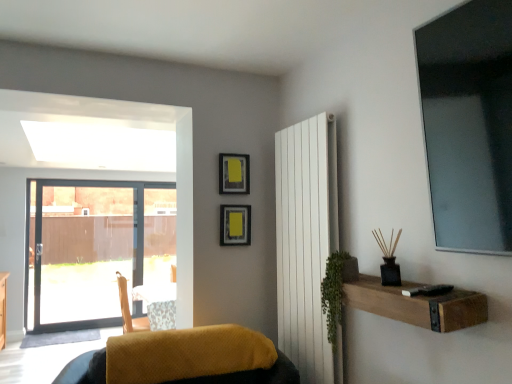
What are the coordinates of `velvet yellow cushion at lower center` in the screenshot? It's located at (184, 359).

The height and width of the screenshot is (384, 512). Describe the element at coordinates (306, 244) in the screenshot. I see `white smooth radiator at center-right` at that location.

Find the location of a particular element. This screenshot has width=512, height=384. brown wooden shelf at lower right is located at coordinates (417, 304).

The image size is (512, 384). In order to click on green leafy plant at right in this screenshot , I will do `click(333, 293)`.

From the image's perspective, is velvet yellow cushion at lower center located above or below white smooth radiator at center-right?

velvet yellow cushion at lower center is situated lower than white smooth radiator at center-right in the image.

Considering the points (85, 374) and (335, 189), which point is behind, point (85, 374) or point (335, 189)?

The point (335, 189) is more distant.

Measure the distance between velvet yellow cushion at lower center and white smooth radiator at center-right.

velvet yellow cushion at lower center and white smooth radiator at center-right are 19.61 inches apart from each other.

Considering the relative positions of velvet yellow cushion at lower center and white smooth radiator at center-right in the image provided, is velvet yellow cushion at lower center to the right of white smooth radiator at center-right from the viewer's perspective?

No, velvet yellow cushion at lower center is not to the right of white smooth radiator at center-right.

Does point (325, 135) come closer to viewer compared to point (461, 298)?

No, (325, 135) is behind (461, 298).

Consider the image. Looking at the image, does white smooth radiator at center-right seem bigger or smaller compared to brown wooden shelf at lower right?

Considering their sizes, white smooth radiator at center-right takes up more space than brown wooden shelf at lower right.

Is white smooth radiator at center-right positioned far away from brown wooden shelf at lower right?

white smooth radiator at center-right is actually quite close to brown wooden shelf at lower right.

Is white smooth radiator at center-right positioned in front of velvet yellow cushion at lower center?

No, it is behind velvet yellow cushion at lower center.

Could you tell me if white smooth radiator at center-right is facing velvet yellow cushion at lower center?

Yes, white smooth radiator at center-right is turned towards velvet yellow cushion at lower center.

From the image's perspective, is white smooth radiator at center-right located above or below velvet yellow cushion at lower center?

From the image's perspective, white smooth radiator at center-right appears above velvet yellow cushion at lower center.

Can you confirm if white smooth radiator at center-right is thinner than velvet yellow cushion at lower center?

Correct, the width of white smooth radiator at center-right is less than that of velvet yellow cushion at lower center.

Considering the positions of objects green leafy plant at right and brown wooden shelf at lower right in the image provided, who is in front, green leafy plant at right or brown wooden shelf at lower right?

brown wooden shelf at lower right is closer to the camera.

Considering the positions of objects green leafy plant at right and brown wooden shelf at lower right in the image provided, who is more to the right, green leafy plant at right or brown wooden shelf at lower right?

From the viewer's perspective, brown wooden shelf at lower right appears more on the right side.

Is green leafy plant at right surrounding brown wooden shelf at lower right?

No, brown wooden shelf at lower right is located outside of green leafy plant at right.

Is point (335, 299) closer or farther from the camera than point (397, 287)?

Point (335, 299) is positioned farther from the camera compared to point (397, 287).

Does green leafy plant at right appear on the left side of velvet yellow cushion at lower center?

In fact, green leafy plant at right is to the right of velvet yellow cushion at lower center.

Looking at this image, from the image's perspective, is green leafy plant at right located above or below velvet yellow cushion at lower center?

From the image's perspective, green leafy plant at right appears above velvet yellow cushion at lower center.

Would you say green leafy plant at right is inside or outside velvet yellow cushion at lower center?

green leafy plant at right is outside velvet yellow cushion at lower center.

In the image, is green leafy plant at right positioned in front of or behind velvet yellow cushion at lower center?

green leafy plant at right is in front of velvet yellow cushion at lower center.

Looking at the image, does velvet yellow cushion at lower center seem bigger or smaller compared to brown wooden shelf at lower right?

velvet yellow cushion at lower center is bigger than brown wooden shelf at lower right.

Considering the relative sizes of velvet yellow cushion at lower center and brown wooden shelf at lower right in the image provided, is velvet yellow cushion at lower center taller than brown wooden shelf at lower right?

Indeed, velvet yellow cushion at lower center has a greater height compared to brown wooden shelf at lower right.

From a real-world perspective, is velvet yellow cushion at lower center physically located above or below brown wooden shelf at lower right?

velvet yellow cushion at lower center is situated lower than brown wooden shelf at lower right in the real world.

Is velvet yellow cushion at lower center facing away from brown wooden shelf at lower right?

No, velvet yellow cushion at lower center is not facing away from brown wooden shelf at lower right.

Based on their sizes in the image, would you say white smooth radiator at center-right is bigger or smaller than green leafy plant at right?

white smooth radiator at center-right is bigger than green leafy plant at right.

Would you consider white smooth radiator at center-right to be distant from green leafy plant at right?

That's not correct — white smooth radiator at center-right is a little close to green leafy plant at right.

Does point (306, 153) appear closer or farther from the camera than point (333, 284)?

Point (306, 153) is farther from the camera than point (333, 284).

Locate an element on the screen. This screenshot has height=384, width=512. plant in front of the white smooth radiator at center-right is located at coordinates (333, 293).

Image resolution: width=512 pixels, height=384 pixels. Identify the location of furniture below the white smooth radiator at center-right (from the image's perspective). (184, 359).

Image resolution: width=512 pixels, height=384 pixels. I want to click on shelf that is under the white smooth radiator at center-right (from a real-world perspective), so click(x=417, y=304).

When comparing their distances from brown wooden shelf at lower right, does green leafy plant at right or velvet yellow cushion at lower center seem closer?

The object closer to brown wooden shelf at lower right is green leafy plant at right.

Based on their spatial positions, is green leafy plant at right or brown wooden shelf at lower right closer to velvet yellow cushion at lower center?

Among the two, green leafy plant at right is located nearer to velvet yellow cushion at lower center.

When comparing their distances from green leafy plant at right, does brown wooden shelf at lower right or velvet yellow cushion at lower center seem closer?

brown wooden shelf at lower right lies closer to green leafy plant at right than the other object.

Estimate the real-world distances between objects in this image. Which object is further from white smooth radiator at center-right, green leafy plant at right or velvet yellow cushion at lower center?

The object further to white smooth radiator at center-right is velvet yellow cushion at lower center.

When comparing their distances from velvet yellow cushion at lower center, does white smooth radiator at center-right or green leafy plant at right seem closer?

The object closer to velvet yellow cushion at lower center is white smooth radiator at center-right.

Estimate the real-world distances between objects in this image. Which object is further from white smooth radiator at center-right, brown wooden shelf at lower right or velvet yellow cushion at lower center?

brown wooden shelf at lower right lies further to white smooth radiator at center-right than the other object.

Based on their spatial positions, is brown wooden shelf at lower right or white smooth radiator at center-right further from velvet yellow cushion at lower center?

Among the two, brown wooden shelf at lower right is located further to velvet yellow cushion at lower center.

Estimate the real-world distances between objects in this image. Which object is closer to brown wooden shelf at lower right, white smooth radiator at center-right or green leafy plant at right?

green leafy plant at right lies closer to brown wooden shelf at lower right than the other object.

Locate an element on the screen. Image resolution: width=512 pixels, height=384 pixels. radiator located between velvet yellow cushion at lower center and brown wooden shelf at lower right in the left-right direction is located at coordinates click(306, 244).

The height and width of the screenshot is (384, 512). What are the coordinates of `plant between velvet yellow cushion at lower center and brown wooden shelf at lower right` in the screenshot? It's located at (333, 293).

Locate an element on the screen. plant located between brown wooden shelf at lower right and white smooth radiator at center-right in the depth direction is located at coordinates (333, 293).

This screenshot has height=384, width=512. I want to click on radiator between velvet yellow cushion at lower center and green leafy plant at right, so click(x=306, y=244).